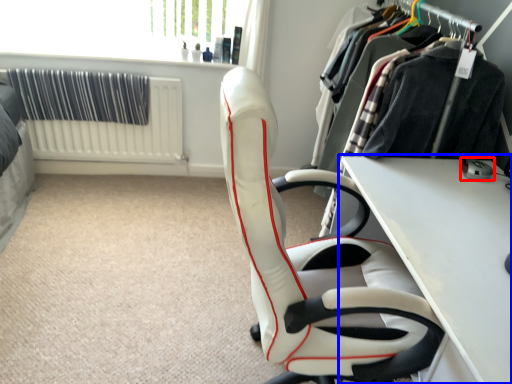
Question: Which object appears farthest to the camera in this image, equipment (highlighted by a red box) or table (highlighted by a blue box)?

Choices:
 (A) equipment
 (B) table

Answer: (A)